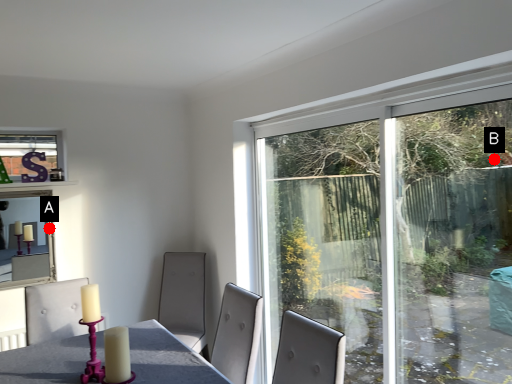
Question: Two points are circled on the image, labeled by A and B beside each circle. Which point appears closest to the camera in this image?

Choices:
 (A) A is closer
 (B) B is closer

Answer: (B)